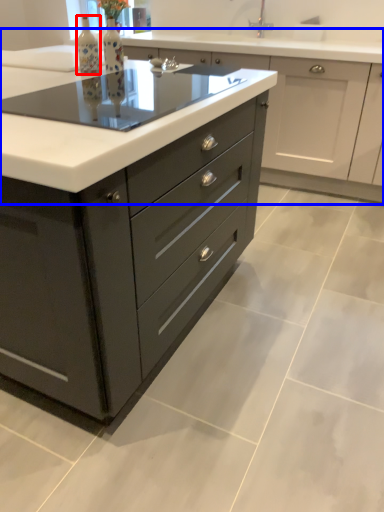
Question: Which object appears farthest to the camera in this image, bottle (highlighted by a red box) or cabinetry (highlighted by a blue box)?

Choices:
 (A) bottle
 (B) cabinetry

Answer: (B)